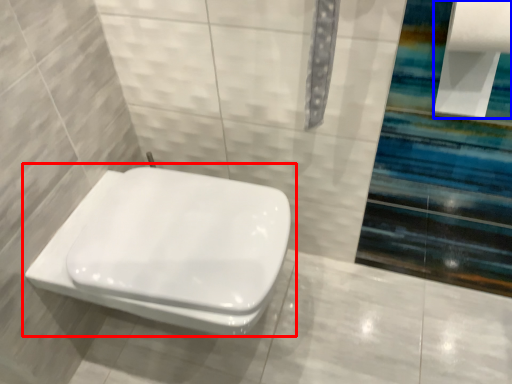
Question: Which object is closer to the camera taking this photo, toilet (highlighted by a red box) or toilet paper (highlighted by a blue box)?

Choices:
 (A) toilet
 (B) toilet paper

Answer: (B)